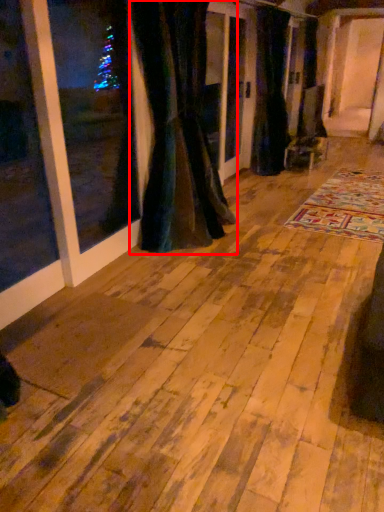
Question: From the image's perspective, what is the correct spatial relationship of curtain (annotated by the red box) in relation to curtain?

Choices:
 (A) below
 (B) above

Answer: (A)